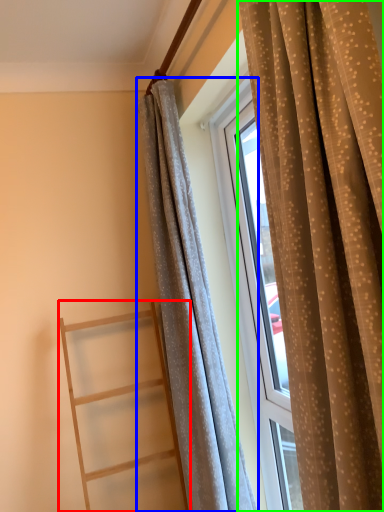
Question: Which object is positioned closest to ladder (highlighted by a red box)? Select from curtain (highlighted by a blue box) and curtain (highlighted by a green box).

Choices:
 (A) curtain
 (B) curtain

Answer: (A)